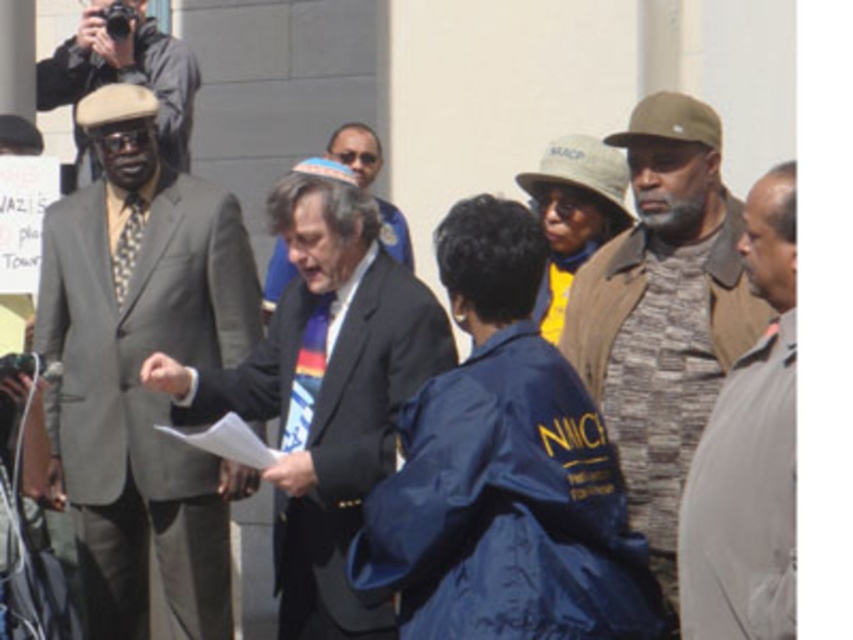
Question: Does gray camouflage jacket at right have a greater width compared to rainbow fabric tie at center?

Choices:
 (A) no
 (B) yes

Answer: (B)

Question: Which of the following is the closest to the observer?

Choices:
 (A) camouflage fabric hat at center
 (B) matte black suit at upper left

Answer: (A)

Question: Among these points, which one is farthest from the camera?

Choices:
 (A) (650, 541)
 (B) (323, 364)

Answer: (B)

Question: Which object is the closest to the camouflage fabric hat at center?

Choices:
 (A) camouflage jacket at right
 (B) gray suit at left
 (C) rainbow fabric tie at center
 (D) gray camouflage jacket at right

Answer: (A)

Question: From the image, what is the correct spatial relationship of camouflage jacket at right in relation to patterned silk tie at left?

Choices:
 (A) below
 (B) above

Answer: (A)

Question: Can you confirm if gray camouflage jacket at right is wider than patterned silk tie at left?

Choices:
 (A) no
 (B) yes

Answer: (B)